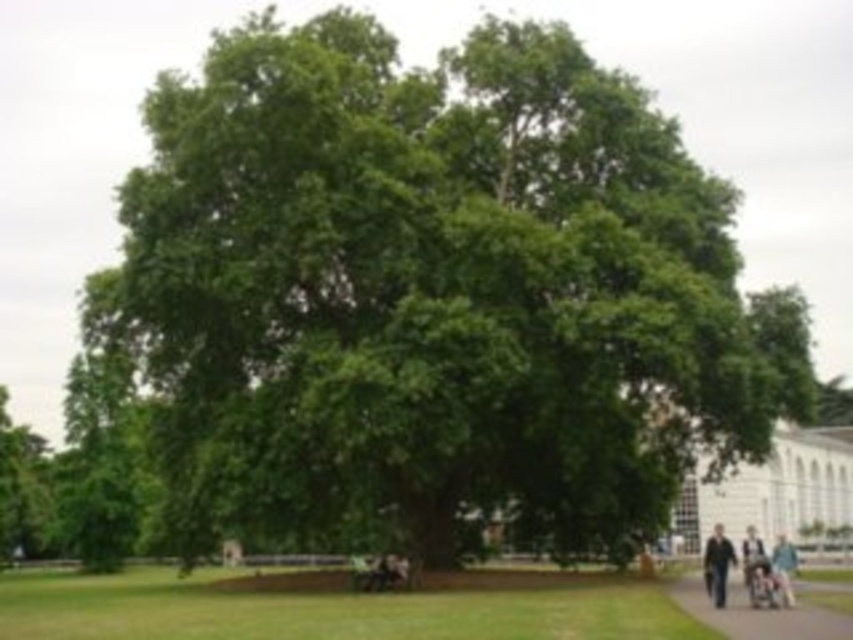
Question: Considering the relative positions of smooth asphalt path at lower right and black plastic baby carriage at lower center in the image provided, where is smooth asphalt path at lower right located with respect to black plastic baby carriage at lower center?

Choices:
 (A) left
 (B) right

Answer: (B)

Question: Which point appears farthest from the camera in this image?

Choices:
 (A) (788, 602)
 (B) (727, 589)

Answer: (B)

Question: Which object appears closest to the camera in this image?

Choices:
 (A) smooth asphalt path at lower right
 (B) green grass at lower center

Answer: (A)

Question: Is smooth asphalt path at lower right bigger than dark blue jeans at lower right?

Choices:
 (A) no
 (B) yes

Answer: (A)

Question: Does smooth asphalt path at lower right lie in front of dark blue jeans at lower right?

Choices:
 (A) yes
 (B) no

Answer: (A)

Question: Which is farther from the smooth asphalt path at lower right?

Choices:
 (A) green grass at lower center
 (B) dark blue jeans at lower right
 (C) light blue jeans at lower right
 (D) black plastic baby carriage at lower center

Answer: (A)